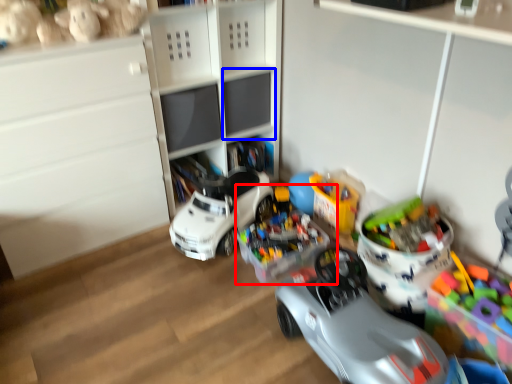
Question: Which of the following is the closest to the observer, toy (highlighted by a red box) or shelf (highlighted by a blue box)?

Choices:
 (A) toy
 (B) shelf

Answer: (A)